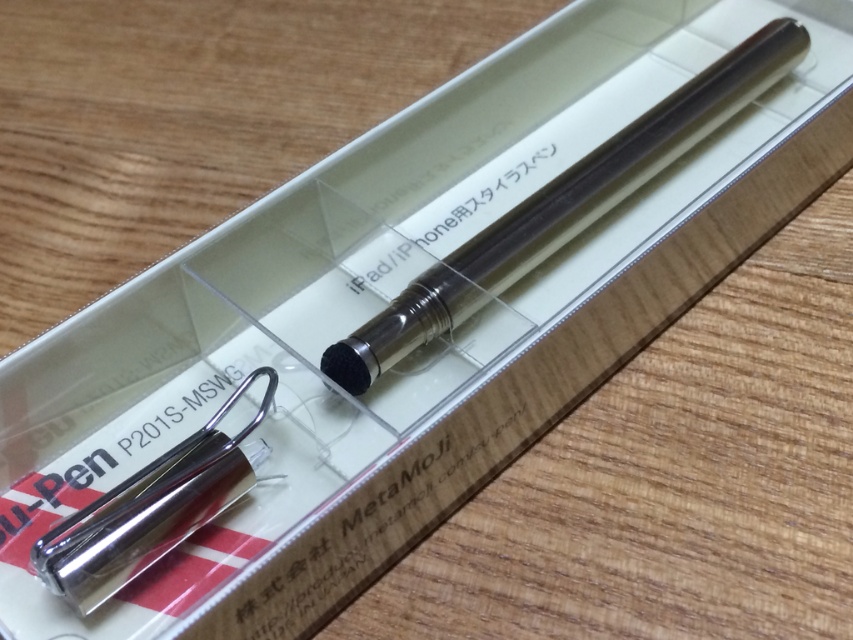
You are a customer at a stationery store looking to buy a pen. You see the satin silver pen at center and the polished silver pen at lower left. Which pen has a larger diameter?

The satin silver pen at center might be wider than polished silver pen at lower left according to the description provided.

You are a customer at a stationery store and want to buy a pen. You see the satin silver pen at center and the polished silver pen at lower left. Which pen is taller?

The satin silver pen at center is taller than the polished silver pen at lower left.

You are holding a ruler and want to measure the distance from your eyes to the satin silver pen at center in the image. If the ruler shows 4.33 feet, how does this compare to the actual distance in the scene?

The distance of the satin silver pen at center from viewer is 4.33 feet, so the ruler measurement matches the actual distance in the scene.